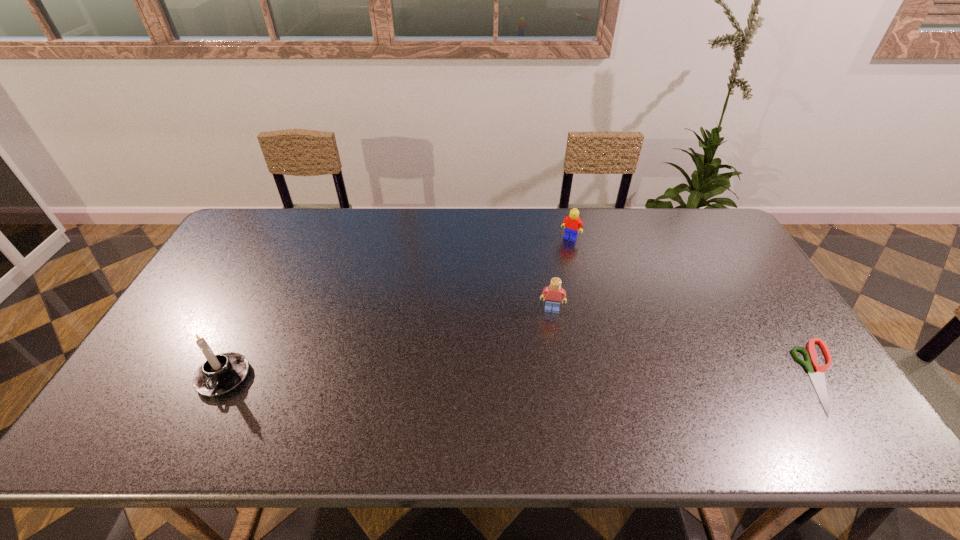
What are the coordinates of `free location that satisfies the following two spatial constraints: 1. on the front side of the farther Lego; 2. on the left side of the scissors` in the screenshot? It's located at (604, 376).

At what (x,y) coordinates should I click in order to perform the action: click on vacant space that satisfies the following two spatial constraints: 1. on the front side of the shortest object; 2. on the left side of the right Lego. Please return your answer as a coordinate pair (x, y). This screenshot has height=540, width=960. Looking at the image, I should click on (604, 376).